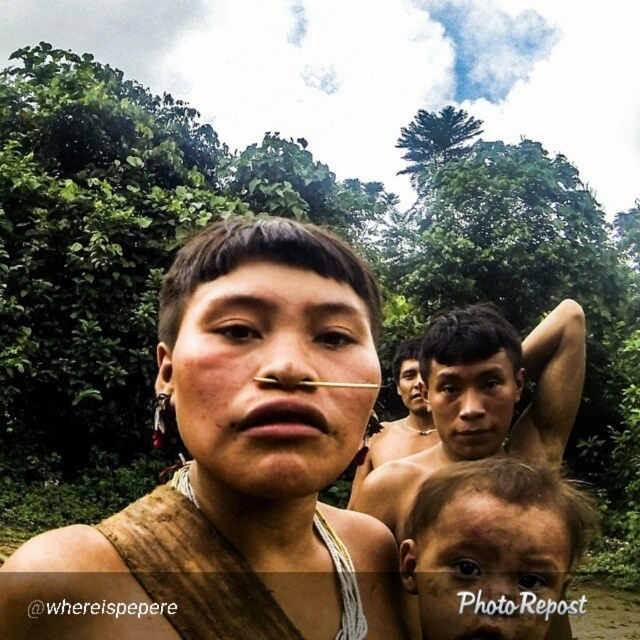
Question: Does brown leather strap at center have a smaller size compared to smooth skin face at center?

Choices:
 (A) no
 (B) yes

Answer: (A)

Question: Which of the following is the farthest from the observer?

Choices:
 (A) (253, 262)
 (B) (221, 460)
 (C) (564, 552)

Answer: (C)

Question: Is brown leather strap at center thinner than brown textured skin at lower right?

Choices:
 (A) no
 (B) yes

Answer: (A)

Question: Which object is closer to the camera taking this photo?

Choices:
 (A) brown leather strap at center
 (B) shiny metallic arm at upper right

Answer: (A)

Question: Can you confirm if shiny metallic arm at upper right is wider than smooth skin face at center?

Choices:
 (A) no
 (B) yes

Answer: (B)

Question: Among these objects, which one is farthest from the camera?

Choices:
 (A) smooth skin face at center
 (B) shiny metallic arm at upper right

Answer: (A)